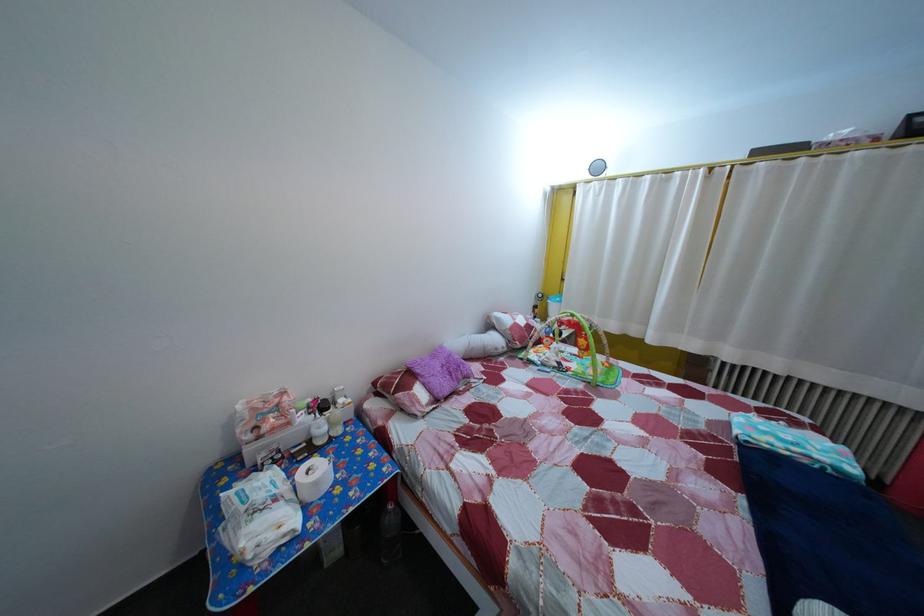
What do you see at coordinates (320, 424) in the screenshot? I see `the bottle pump` at bounding box center [320, 424].